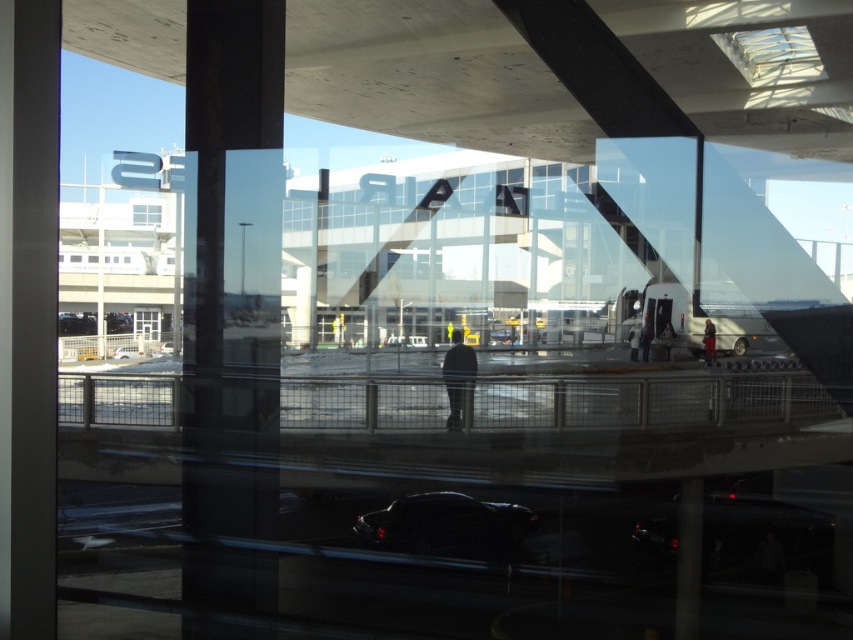
You are standing inside an airport terminal and looking through the transparent glass window at center. You notice a black glossy car at lower right in the reflection of the interior surface. Can you determine if the car is physically present outside the window or just a reflection?

The black glossy car at lower right is closer to the viewer than the transparent glass window at center, so it is part of the reflection on the interior surface and not physically present outside the window.

You are standing inside an airport terminal and looking through the clear glass window at center. There is a shiny black car at center reflected in the window. Can you tell if the car is actually parked outside the window or just its reflection?

The shiny black car at center is closer to the viewer than the clear glass window at center, so the car is likely a reflection on the window rather than an actual parked car outside.

You are a delivery drone operator. Your drone needs to fly from the black glossy car at lower right to the transparent glass window at center. Given that the drone has a maximum flight range of 35 meters, will it be able to reach the destination without recharging?

The black glossy car at lower right and transparent glass window at center are 36.89 meters apart from each other. Since the drone can only fly 35 meters before needing to recharge, it cannot reach the destination without recharging.